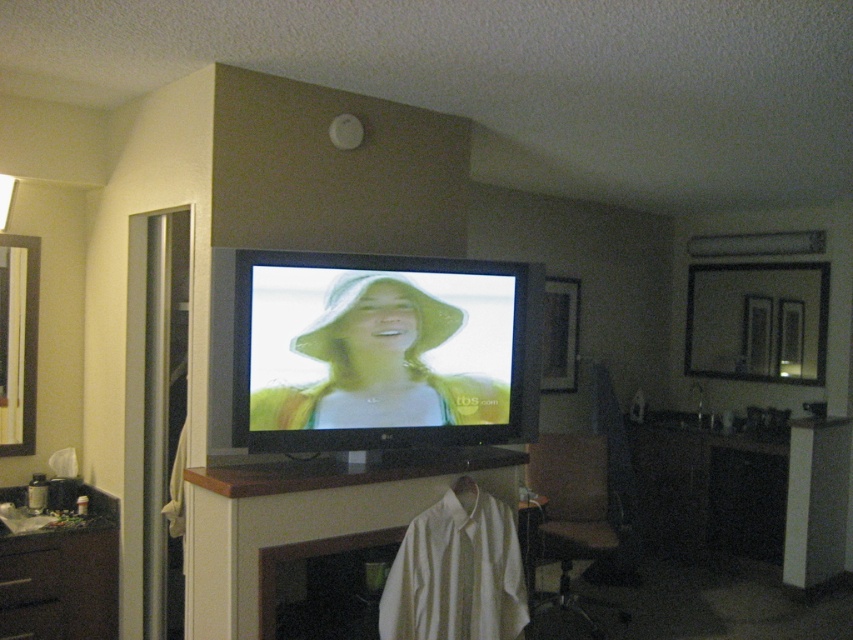
You are arranging items on a shelf in front of a TV. You have a white fabric shirt at center and a matte yellow hat at center. According to the scene, which item is positioned to the left?

The white fabric shirt at center is positioned to the left of the matte yellow hat at center.

You are a guest in this living room and want to place a small vase on the dark brown wood dresser at lower left. However, you need to ensure there is enough space. Can you determine if the white fabric shirt at center is blocking the area where you want to place the vase?

The white fabric shirt at center is above the dark brown wood dresser at lower left, so it is not blocking the area where you want to place the vase. You can safely place the vase on the dresser.

You are a guest in this living room and need to sit down. There is a dark brown wood dresser at lower left and a wooden seat at lower right. Which object can you sit on?

The wooden seat at lower right is larger than the dark brown wood dresser at lower left, so you can sit on the wooden seat at lower right.